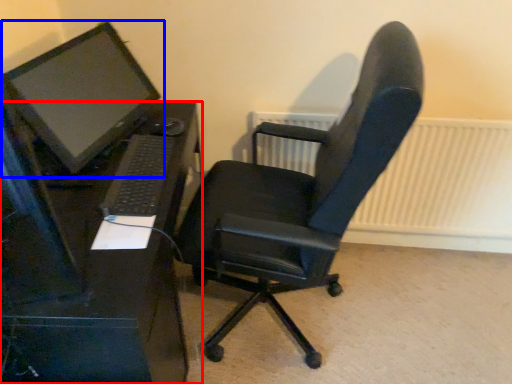
Question: Which of the following is the farthest to the observer, desk (highlighted by a red box) or computer monitor (highlighted by a blue box)?

Choices:
 (A) desk
 (B) computer monitor

Answer: (B)